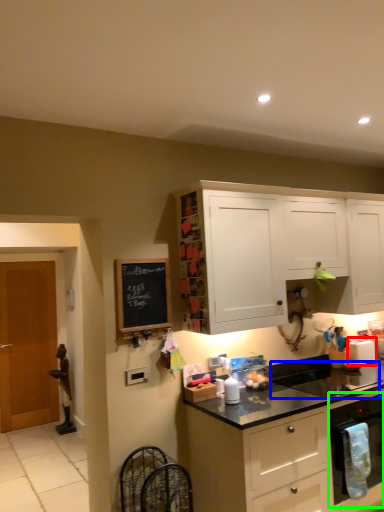
Question: Which object is the closest to the appliance (highlighted by a red box)? Choose among these: sink (highlighted by a blue box) or kitchen appliance (highlighted by a green box).

Choices:
 (A) sink
 (B) kitchen appliance

Answer: (A)